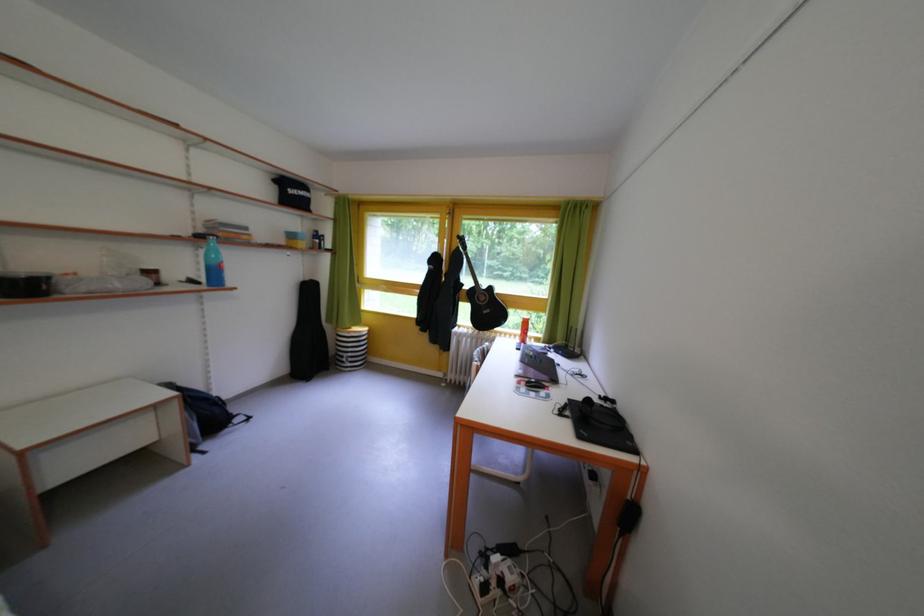
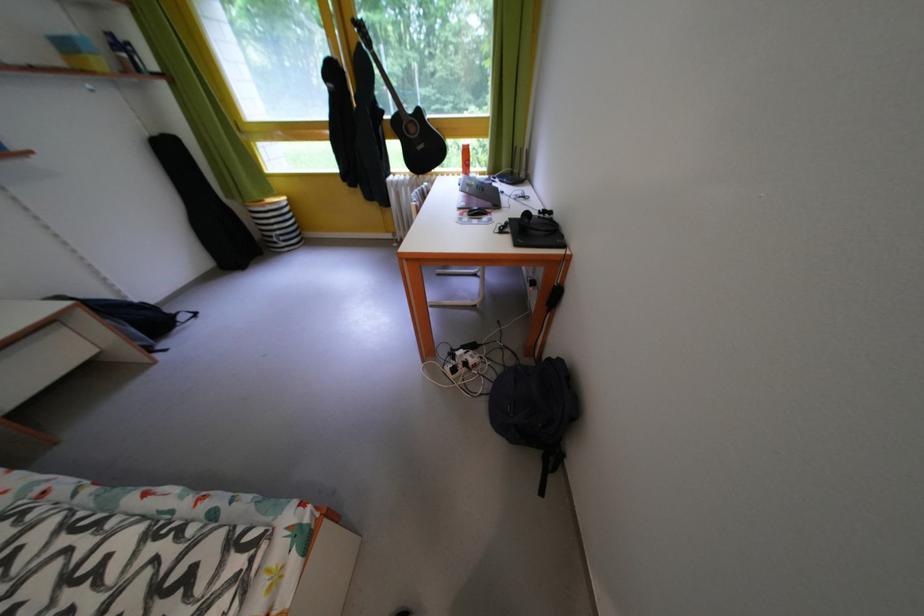
The point at (610, 403) is marked in the first image. Where is the corresponding point in the second image?

(550, 217)